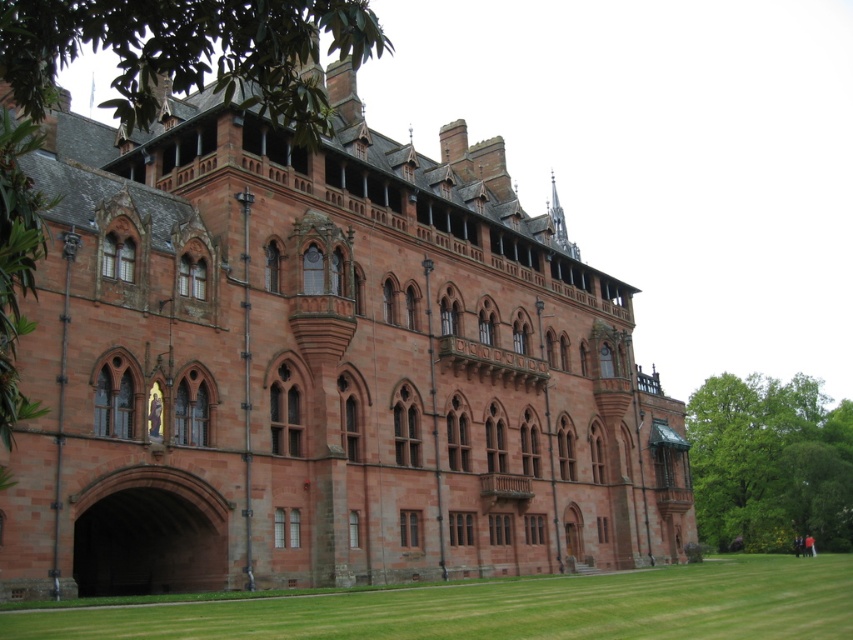
Is green grass at lower center wider than green leafy tree at lower right?

Incorrect, green grass at lower center's width does not surpass green leafy tree at lower right's.

Does green grass at lower center have a lesser height compared to green leafy tree at lower right?

Indeed, green grass at lower center has a lesser height compared to green leafy tree at lower right.

Does point (318, 595) come farther from viewer compared to point (793, 408)?

No, it is in front of (793, 408).

I want to click on green grass at lower center, so click(x=503, y=608).

Which is in front, point (599, 608) or point (28, 67)?

Point (28, 67) is more forward.

Is point (184, 616) positioned in front of point (24, 104)?

That is False.

The width and height of the screenshot is (853, 640). I want to click on green grass at lower center, so click(x=503, y=608).

Is green leafy tree at upper center below green leafy tree at lower right?

No.

Can you confirm if green leafy tree at upper center is thinner than green leafy tree at lower right?

In fact, green leafy tree at upper center might be wider than green leafy tree at lower right.

Identify the location of green leafy tree at upper center. (189, 52).

Identify the location of green leafy tree at upper center. The image size is (853, 640). (189, 52).